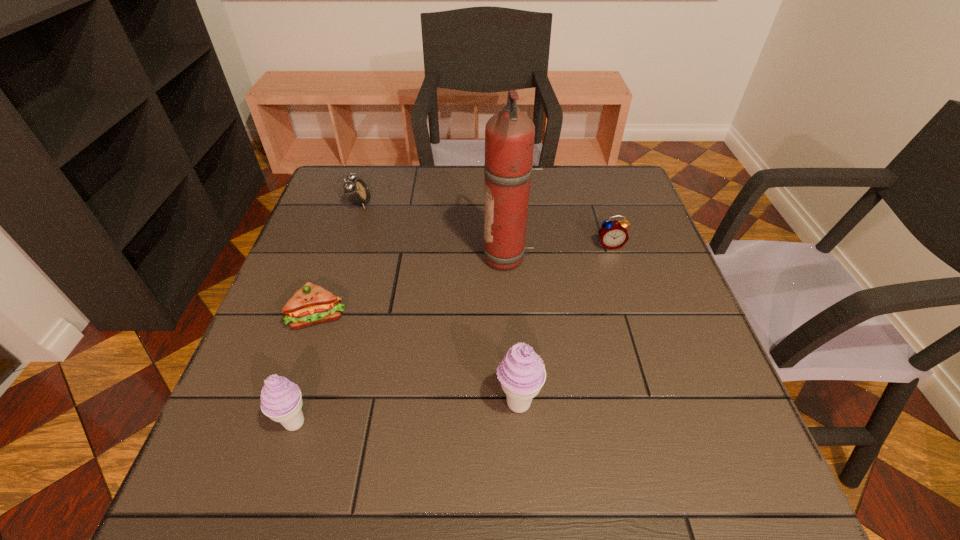
This screenshot has height=540, width=960. Find the location of `free space at the near right corner of the desktop`. free space at the near right corner of the desktop is located at coordinates (726, 405).

Locate an element on the screen. The height and width of the screenshot is (540, 960). empty location between the fire extinguisher and the third nearest object is located at coordinates (413, 287).

The width and height of the screenshot is (960, 540). Identify the location of empty location between the tallest object and the left alarm clock. (434, 231).

Image resolution: width=960 pixels, height=540 pixels. What are the coordinates of `empty space that is in between the left alarm clock and the sandwich` in the screenshot? It's located at (339, 260).

I want to click on free space between the left alarm clock and the fourth farthest object, so click(339, 260).

The height and width of the screenshot is (540, 960). I want to click on vacant point located between the nearer alarm clock and the fourth farthest object, so click(465, 280).

This screenshot has height=540, width=960. I want to click on free space between the second tallest object and the farthest object, so click(439, 303).

Identify the location of vacant space in between the shorter icecream and the fire extinguisher. (401, 340).

Identify the location of object that is the fourth closest to the taller icecream. The height and width of the screenshot is (540, 960). 613,234.

Identify which object is the closest to the fire extinguisher. Please provide its 2D coordinates. Your answer should be formatted as a tuple, i.e. [(x, y)], where the tuple contains the x and y coordinates of a point satisfying the conditions above.

[(613, 234)]